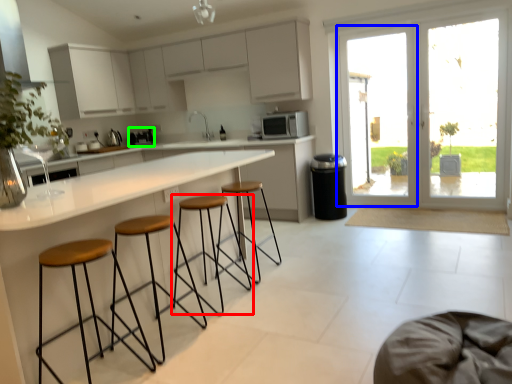
Question: Which object is the closest to the stool (highlighted by a red box)? Choose among these: screen door (highlighted by a blue box) or coffee machine (highlighted by a green box).

Choices:
 (A) screen door
 (B) coffee machine

Answer: (B)